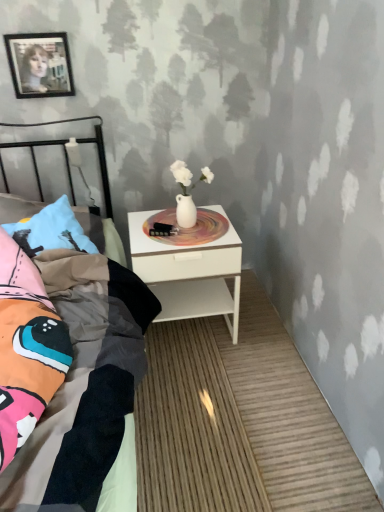
Find the location of a particular element. vacant area to the right of white glossy nightstand at center is located at coordinates (264, 332).